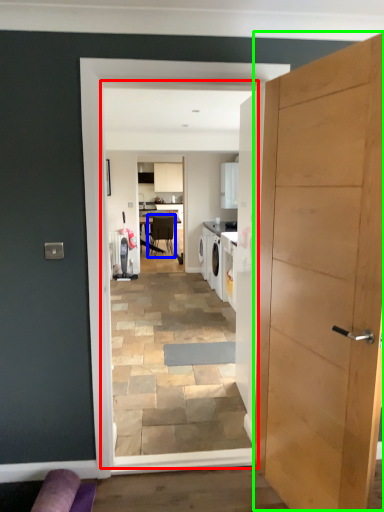
Question: Which object is positioned closest to residence (highlighted by a red box)? Select from chair (highlighted by a blue box) and door (highlighted by a green box).

Choices:
 (A) chair
 (B) door

Answer: (B)